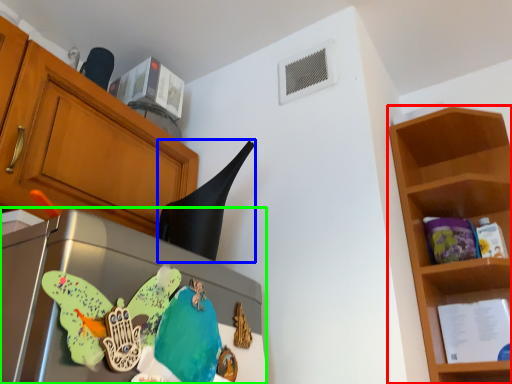
Question: Based on their relative distances, which object is nearer to shelf (highlighted by a red box)? Choose from exhaust hood (highlighted by a blue box) and appliance (highlighted by a green box).

Choices:
 (A) exhaust hood
 (B) appliance

Answer: (A)